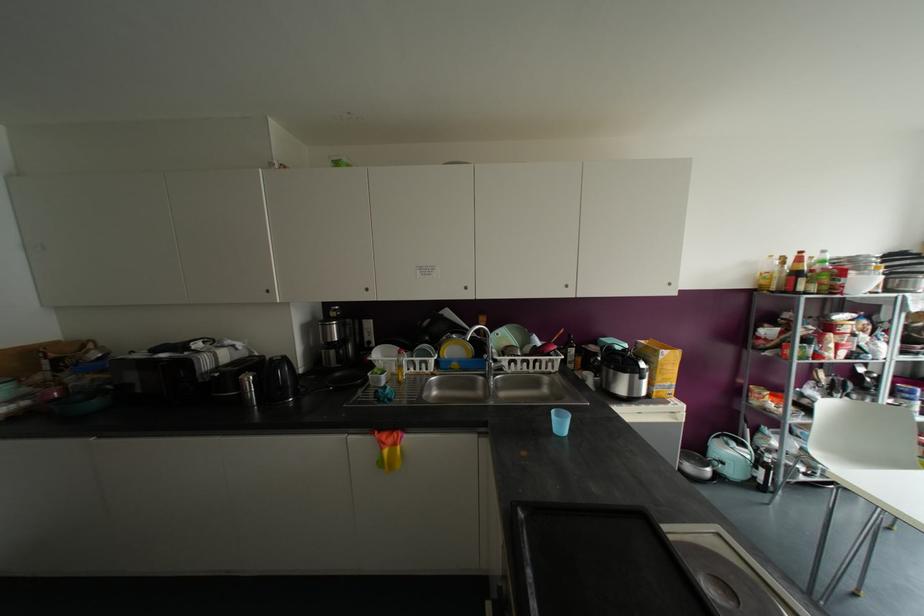
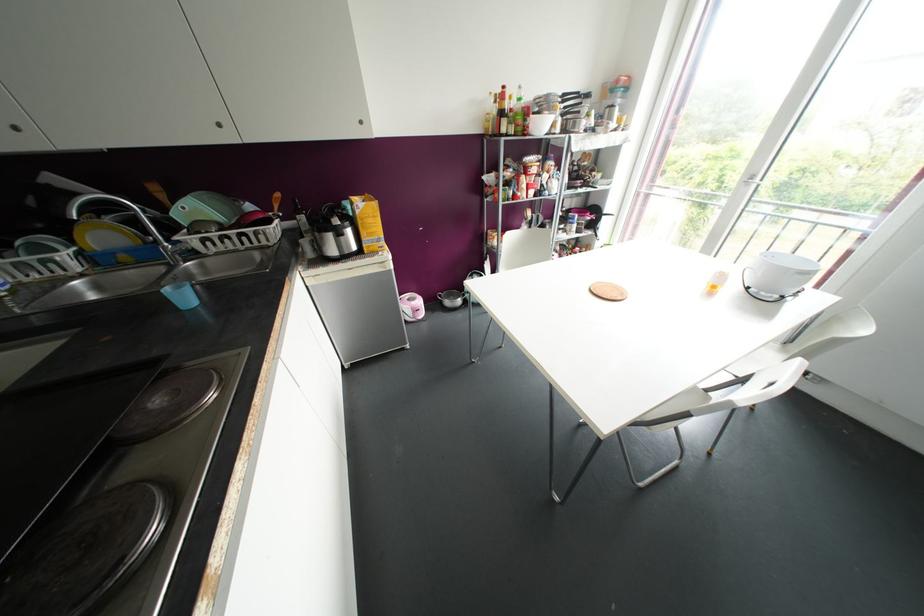
Where in the second image is the point corresponding to (561,424) from the first image?

(184, 297)